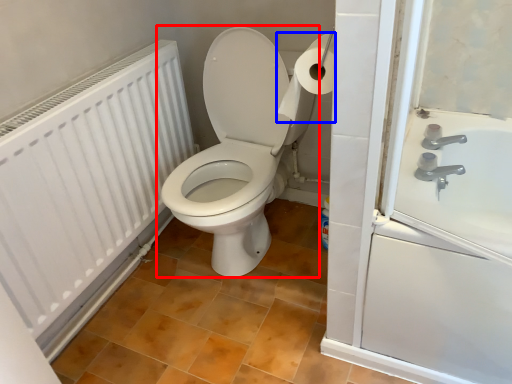
Question: Which object appears closest to the camera in this image, toilet (highlighted by a red box) or toilet paper (highlighted by a blue box)?

Choices:
 (A) toilet
 (B) toilet paper

Answer: (B)